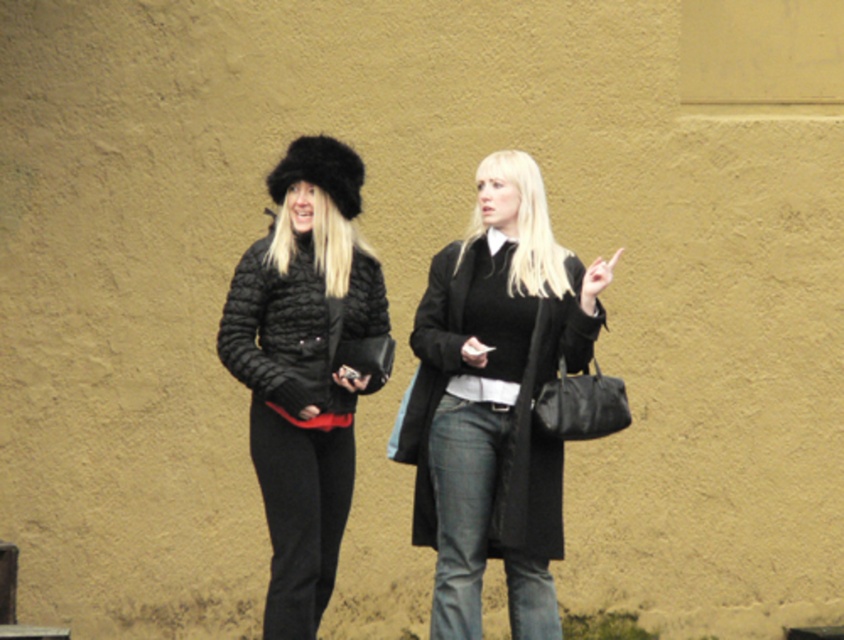
Question: Which object is farther from the camera taking this photo?

Choices:
 (A) matte black fur hat at upper left
 (B) black matte coat at center

Answer: (B)

Question: Which of the following is the closest to the observer?

Choices:
 (A) matte black fur hat at upper left
 (B) black matte coat at center

Answer: (A)

Question: Does matte black fur hat at upper left have a larger size compared to black matte coat at center?

Choices:
 (A) no
 (B) yes

Answer: (B)

Question: Which point appears closest to the camera in this image?

Choices:
 (A) (507, 516)
 (B) (344, 179)
 (C) (339, 317)

Answer: (A)

Question: Can you confirm if matte black fur hat at upper left is smaller than quilted black coat at center?

Choices:
 (A) yes
 (B) no

Answer: (B)

Question: Is matte black fur hat at upper left bigger than quilted black coat at center?

Choices:
 (A) yes
 (B) no

Answer: (A)